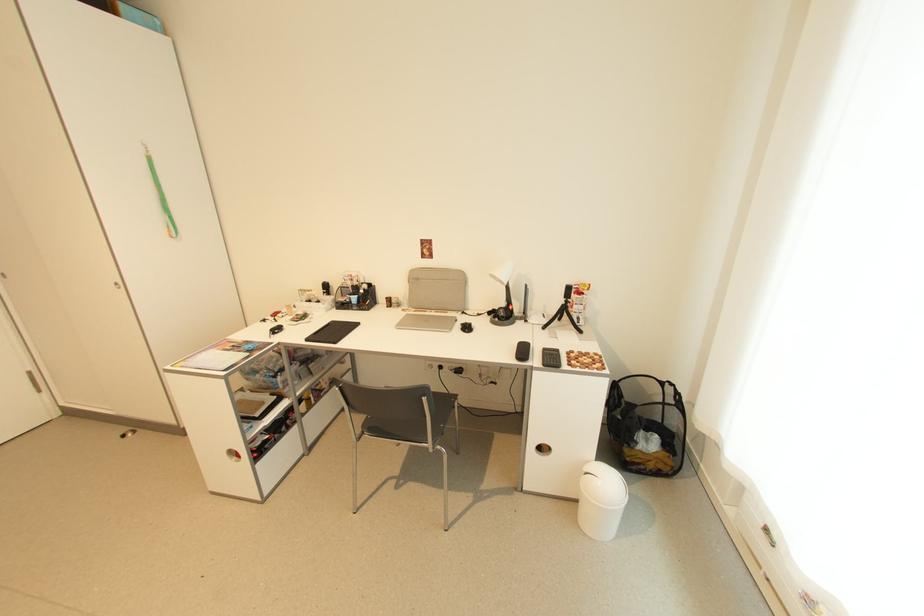
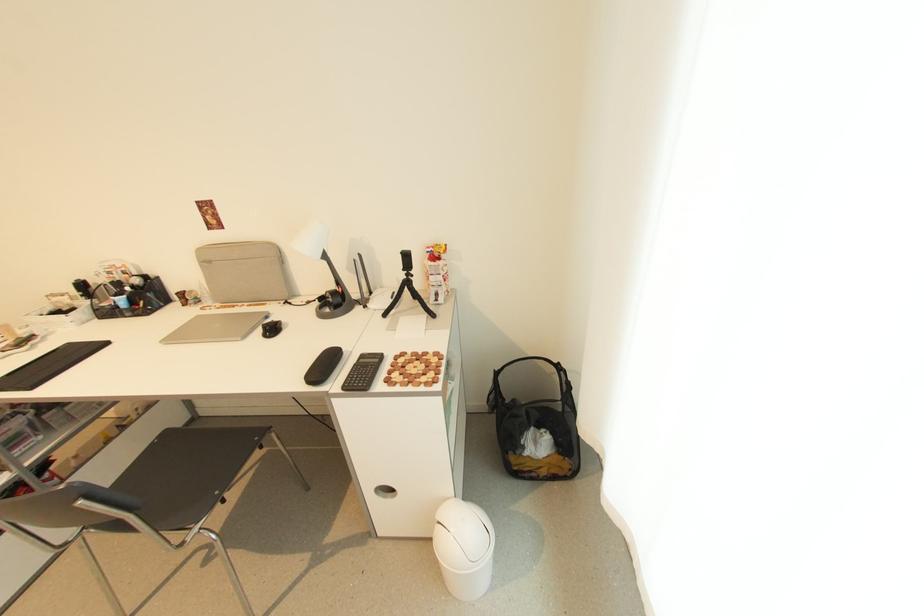
Which direction would the cameraman need to move to produce the second image?

The cameraman moved toward right, forward.